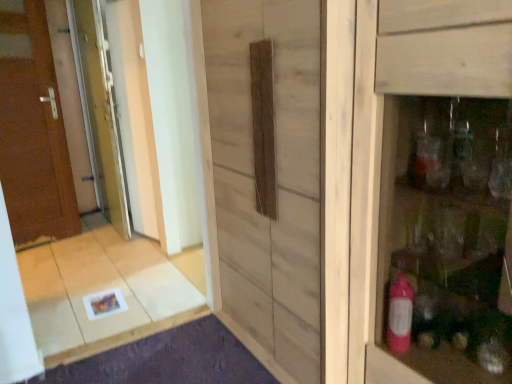
Question: Is clear glass screen door at left, the second screen door viewed from the right, closer to camera compared to matte wooden cabinet at right?

Choices:
 (A) yes
 (B) no

Answer: (B)

Question: Does clear glass screen door at left, which is the first screen door in left-to-right order, have a larger size compared to matte wooden cabinet at right?

Choices:
 (A) yes
 (B) no

Answer: (B)

Question: From a real-world perspective, is clear glass screen door at left, which is the first screen door in left-to-right order, physically above matte wooden cabinet at right?

Choices:
 (A) yes
 (B) no

Answer: (A)

Question: Is clear glass screen door at left, which is the first screen door in left-to-right order, taller than matte wooden cabinet at right?

Choices:
 (A) no
 (B) yes

Answer: (B)

Question: Does clear glass screen door at left, which is the first screen door in left-to-right order, have a smaller size compared to matte wooden cabinet at right?

Choices:
 (A) yes
 (B) no

Answer: (A)

Question: Is natural wood barn door at center inside or outside of matte wooden cabinet at right?

Choices:
 (A) outside
 (B) inside

Answer: (A)

Question: Would you say natural wood barn door at center is to the left or to the right of matte wooden cabinet at right in the picture?

Choices:
 (A) left
 (B) right

Answer: (A)

Question: From the image's perspective, relative to matte wooden cabinet at right, is natural wood barn door at center above or below?

Choices:
 (A) below
 (B) above

Answer: (B)

Question: Considering the positions of natural wood barn door at center and matte wooden cabinet at right in the image, is natural wood barn door at center taller or shorter than matte wooden cabinet at right?

Choices:
 (A) short
 (B) tall

Answer: (B)

Question: Relative to natural wood barn door at center, is clear glass screen door at left, acting as the 2th screen door starting from the left, in front or behind?

Choices:
 (A) front
 (B) behind

Answer: (B)

Question: Do you think clear glass screen door at left, which is the first screen door from right to left, is within natural wood barn door at center, or outside of it?

Choices:
 (A) outside
 (B) inside

Answer: (A)

Question: Considering the positions of point (124, 139) and point (313, 115), is point (124, 139) closer or farther from the camera than point (313, 115)?

Choices:
 (A) closer
 (B) farther

Answer: (B)

Question: From the image's perspective, is clear glass screen door at left, acting as the 2th screen door starting from the left, above or below natural wood barn door at center?

Choices:
 (A) below
 (B) above

Answer: (B)

Question: From a real-world perspective, is matte wooden cabinet at right above or below natural wood barn door at center?

Choices:
 (A) above
 (B) below

Answer: (B)

Question: Is matte wooden cabinet at right inside or outside of natural wood barn door at center?

Choices:
 (A) inside
 (B) outside

Answer: (B)